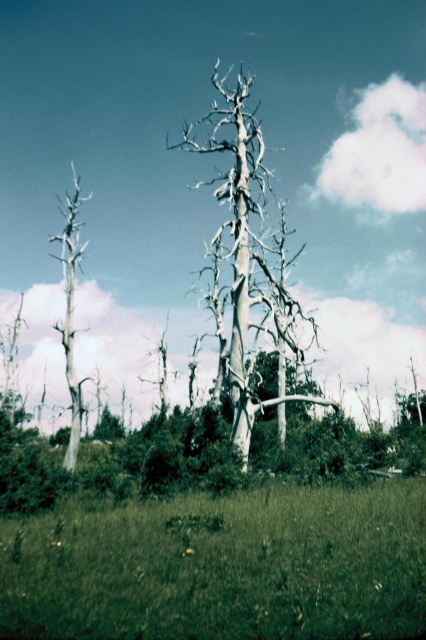
You are a gardener who needs to plant a new tree sapling in the field. The sapling requires at least 16 meters of space between it and any existing trees to thrive. Given the current layout, can you plant the sapling safely between the green grass at lower center and the gray bark tree at left?

The distance between the green grass at lower center and the gray bark tree at left is 15.55 meters, which is less than the required 16 meters. Therefore, planting the sapling between them would not provide enough space for it to thrive.

You are an environmental scientist assessing the health of a forest. You observe the white textured tree at center and the gray bark tree at left. Which tree would you prioritize for further study based on their sizes?

The gray bark tree at left is larger than the white textured tree at center, so it may indicate a different stage of decay or species, making it a priority for study.

You are standing at the origin point in the image. Which direction should you move to reach the green grass at lower center?

The green grass at lower center is located at point (222, 566), so you should move towards the lower center direction to reach it.